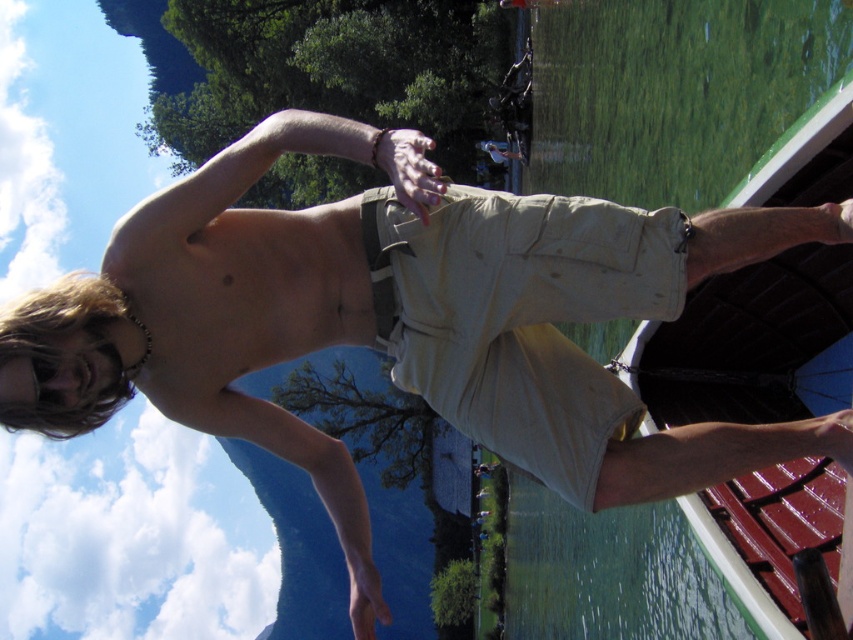
You are a photographer capturing the scene of a person diving. You need to ensure both the green smooth water at lower right and the khaki cotton shorts at center are in focus. Which object should you prioritize focusing on if you want the larger one to be sharp?

The green smooth water at lower right has a larger size compared to the khaki cotton shorts at center, so you should prioritize focusing on the green smooth water at lower right to ensure it appears sharp.

You are a photographer capturing the scene of a person diving. You notice the green smooth water at lower right and the khaki cotton shorts at center. Based on their positions, can you determine if the person is about to enter the water or has already entered it?

The green smooth water at lower right is below khaki cotton shorts at center, which indicates that the person is about to enter the water as the shorts are positioned above the water.